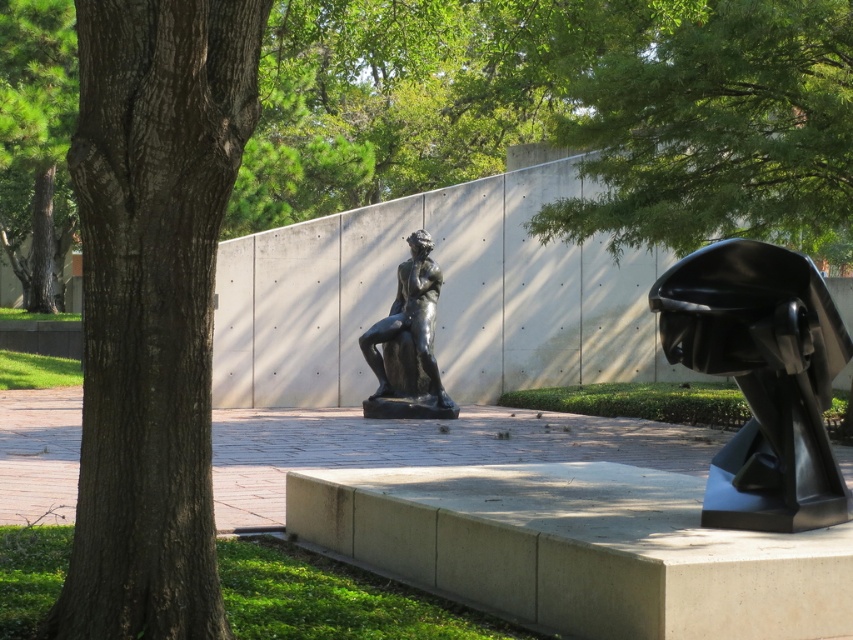
Question: Which of the following is the farthest from the observer?

Choices:
 (A) (74, 72)
 (B) (196, 348)
 (C) (419, 280)

Answer: (A)

Question: Based on their relative distances, which object is nearer to the brown rough bark tree at left?

Choices:
 (A) bronze statue at center
 (B) green leafy tree at left
 (C) black glossy sculpture at right

Answer: (C)

Question: Is black glossy sculpture at right above green leafy tree at left?

Choices:
 (A) yes
 (B) no

Answer: (B)

Question: Is black glossy sculpture at right to the left of bronze statue at center from the viewer's perspective?

Choices:
 (A) yes
 (B) no

Answer: (B)

Question: Which object is positioned closest to the bronze statue at center?

Choices:
 (A) black glossy sculpture at right
 (B) brown rough bark tree at left
 (C) green leafy tree at left

Answer: (C)

Question: Does black glossy sculpture at right appear on the left side of green leafy tree at left?

Choices:
 (A) no
 (B) yes

Answer: (A)